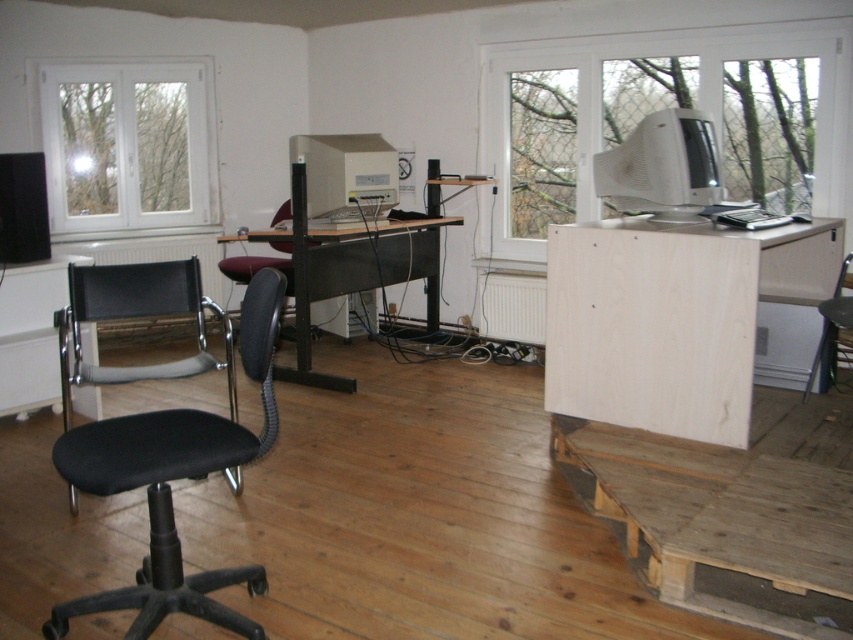
Is transparent glass monitor at right bigger than matte black keyboard at right?

Indeed, transparent glass monitor at right has a larger size compared to matte black keyboard at right.

Who is taller, transparent glass monitor at right or matte black keyboard at right?

transparent glass monitor at right

Image resolution: width=853 pixels, height=640 pixels. What do you see at coordinates (660, 108) in the screenshot?
I see `transparent glass monitor at right` at bounding box center [660, 108].

Where is `transparent glass monitor at right`? transparent glass monitor at right is located at coordinates (660, 108).

Which is more to the left, transparent glass monitor at right or weathered wood pallet at lower right?

From the viewer's perspective, weathered wood pallet at lower right appears more on the left side.

Can you confirm if transparent glass monitor at right is shorter than weathered wood pallet at lower right?

No.

This screenshot has height=640, width=853. Identify the location of transparent glass monitor at right. (660, 108).

Is point (256, 580) closer to camera compared to point (115, 74)?

Yes, point (256, 580) is closer to viewer.

Is black fabric swivel chair at lower left to the right of white plastic window at upper left from the viewer's perspective?

Indeed, black fabric swivel chair at lower left is positioned on the right side of white plastic window at upper left.

Where is `black fabric swivel chair at lower left`? black fabric swivel chair at lower left is located at coordinates (167, 444).

Find the location of a particular element. black fabric swivel chair at lower left is located at coordinates (167, 444).